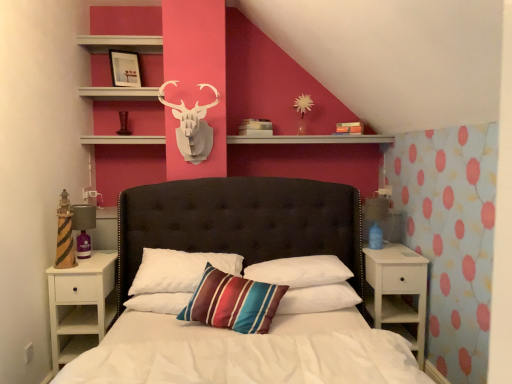
Question: Would you say matte black picture frame at upper center contains striped fabric pillow at center, the 2th pillow positioned from the left?

Choices:
 (A) yes
 (B) no

Answer: (B)

Question: Does matte black picture frame at upper center turn towards striped fabric pillow at center, positioned as the third pillow in right-to-left order?

Choices:
 (A) no
 (B) yes

Answer: (A)

Question: Considering the relative positions of matte black picture frame at upper center and striped fabric pillow at center, positioned as the third pillow in right-to-left order, in the image provided, is matte black picture frame at upper center to the left of striped fabric pillow at center, positioned as the third pillow in right-to-left order, from the viewer's perspective?

Choices:
 (A) no
 (B) yes

Answer: (B)

Question: From a real-world perspective, is matte black picture frame at upper center below striped fabric pillow at center, the 2th pillow positioned from the left?

Choices:
 (A) no
 (B) yes

Answer: (A)

Question: From the image's perspective, does matte black picture frame at upper center appear higher than striped fabric pillow at center, positioned as the third pillow in right-to-left order?

Choices:
 (A) yes
 (B) no

Answer: (A)

Question: From the image's perspective, is striped fabric pillow at center, marked as the 1th pillow in a left-to-right arrangement, above or below white matte nightstand at right, the second nightstand positioned from the left?

Choices:
 (A) below
 (B) above

Answer: (B)

Question: Is striped fabric pillow at center, the fourth pillow from the right, wider or thinner than white matte nightstand at right, the second nightstand positioned from the left?

Choices:
 (A) thin
 (B) wide

Answer: (A)

Question: Which is correct: striped fabric pillow at center, marked as the 1th pillow in a left-to-right arrangement, is inside white matte nightstand at right, which is the 1th nightstand from right to left, or outside of it?

Choices:
 (A) outside
 (B) inside

Answer: (A)

Question: From a real-world perspective, is striped fabric pillow at center, the fourth pillow from the right, positioned above or below white matte nightstand at right, the second nightstand positioned from the left?

Choices:
 (A) above
 (B) below

Answer: (A)

Question: Is white soft pillow at center, placed as the fourth pillow when sorted from left to right, inside the boundaries of white soft pillow at center, positioned as the 3th pillow in left-to-right order, or outside?

Choices:
 (A) inside
 (B) outside

Answer: (A)

Question: In terms of width, does white soft pillow at center, placed as the fourth pillow when sorted from left to right, look wider or thinner when compared to white soft pillow at center, positioned as the 3th pillow in left-to-right order?

Choices:
 (A) thin
 (B) wide

Answer: (B)

Question: Is white soft pillow at center, acting as the first pillow starting from the right, in front of or behind white soft pillow at center, which is the second pillow from right to left, in the image?

Choices:
 (A) front
 (B) behind

Answer: (A)

Question: Considering the relative positions of white soft pillow at center, acting as the first pillow starting from the right, and white soft pillow at center, which is the second pillow from right to left, in the image provided, is white soft pillow at center, acting as the first pillow starting from the right, to the left or to the right of white soft pillow at center, which is the second pillow from right to left,?

Choices:
 (A) right
 (B) left

Answer: (A)

Question: Is striped fabric pillow at center, positioned as the third pillow in right-to-left order, wider or thinner than white matte shelf at upper center?

Choices:
 (A) wide
 (B) thin

Answer: (B)

Question: From the image's perspective, relative to white matte shelf at upper center, is striped fabric pillow at center, positioned as the third pillow in right-to-left order, above or below?

Choices:
 (A) above
 (B) below

Answer: (B)